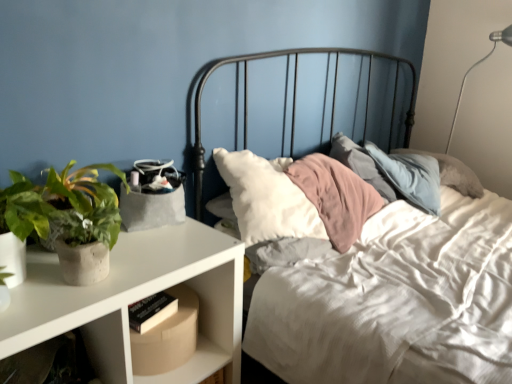
Question: From a real-world perspective, is cardboard box at lower left located higher than white matte nightstand at left?

Choices:
 (A) no
 (B) yes

Answer: (B)

Question: Is the depth of cardboard box at lower left less than that of white matte nightstand at left?

Choices:
 (A) yes
 (B) no

Answer: (B)

Question: Is cardboard box at lower left taller than white matte nightstand at left?

Choices:
 (A) yes
 (B) no

Answer: (B)

Question: Is cardboard box at lower left oriented towards white matte nightstand at left?

Choices:
 (A) no
 (B) yes

Answer: (B)

Question: Considering the relative sizes of cardboard box at lower left and white matte nightstand at left in the image provided, is cardboard box at lower left thinner than white matte nightstand at left?

Choices:
 (A) no
 (B) yes

Answer: (B)

Question: Is cardboard box at lower left shorter than white matte nightstand at left?

Choices:
 (A) no
 (B) yes

Answer: (B)

Question: From the image's perspective, is green matte plant at left on top of white matte nightstand at left?

Choices:
 (A) no
 (B) yes

Answer: (B)

Question: Can you confirm if green matte plant at left is positioned to the left of white matte nightstand at left?

Choices:
 (A) yes
 (B) no

Answer: (A)

Question: Considering the relative positions of green matte plant at left and white matte nightstand at left in the image provided, is green matte plant at left to the right of white matte nightstand at left from the viewer's perspective?

Choices:
 (A) yes
 (B) no

Answer: (B)

Question: Is green matte plant at left oriented towards white matte nightstand at left?

Choices:
 (A) no
 (B) yes

Answer: (A)

Question: Considering the relative sizes of green matte plant at left and white matte nightstand at left in the image provided, is green matte plant at left bigger than white matte nightstand at left?

Choices:
 (A) yes
 (B) no

Answer: (B)

Question: Does green matte plant at left have a greater height compared to white matte nightstand at left?

Choices:
 (A) yes
 (B) no

Answer: (B)

Question: From a real-world perspective, is green matte plant at left located higher than cardboard box at lower left?

Choices:
 (A) no
 (B) yes

Answer: (B)